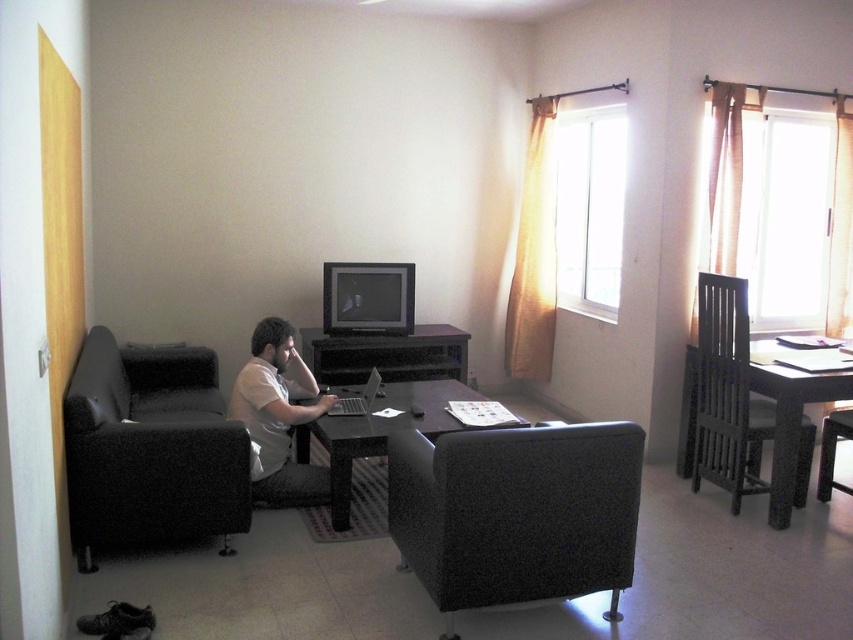
Is point (398, 410) more distant than point (372, 369)?

That is False.

Can you confirm if black glossy table at center is positioned to the left of silver metallic laptop at center?

Incorrect, black glossy table at center is not on the left side of silver metallic laptop at center.

Who is more forward, (339, 467) or (368, 376)?

Positioned in front is point (339, 467).

The height and width of the screenshot is (640, 853). Find the location of `black glossy table at center`. black glossy table at center is located at coordinates (378, 433).

Does point (775, 513) come farther from viewer compared to point (846, 412)?

No, (775, 513) is closer to viewer.

Who is higher up, black wooden table at right or black fabric chair at lower right?

black wooden table at right is above.

Is point (790, 477) closer to viewer compared to point (845, 433)?

Yes.

This screenshot has height=640, width=853. Find the location of `black wooden table at right`. black wooden table at right is located at coordinates (791, 426).

Consider the image. Can you confirm if black fabric couch at left is bigger than black wooden table at right?

Yes, black fabric couch at left is bigger than black wooden table at right.

This screenshot has width=853, height=640. I want to click on black fabric couch at left, so click(x=149, y=449).